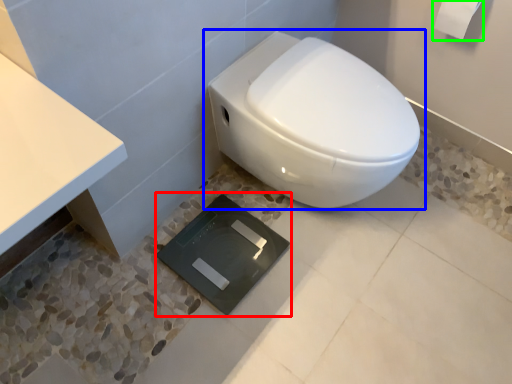
Question: Which object is positioned farthest from pad (highlighted by a red box)? Select from toilet (highlighted by a blue box) and toilet paper (highlighted by a green box).

Choices:
 (A) toilet
 (B) toilet paper

Answer: (B)